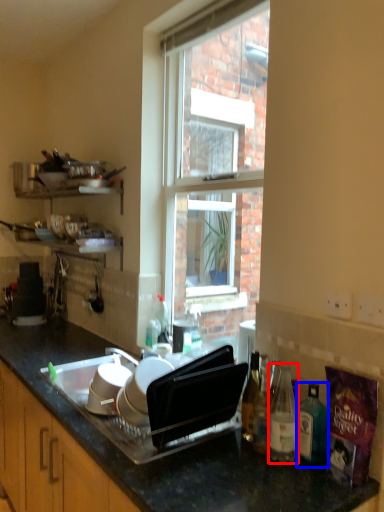
Question: Which object appears closest to the camera in this image, bottle (highlighted by a red box) or bottle (highlighted by a blue box)?

Choices:
 (A) bottle
 (B) bottle

Answer: (A)